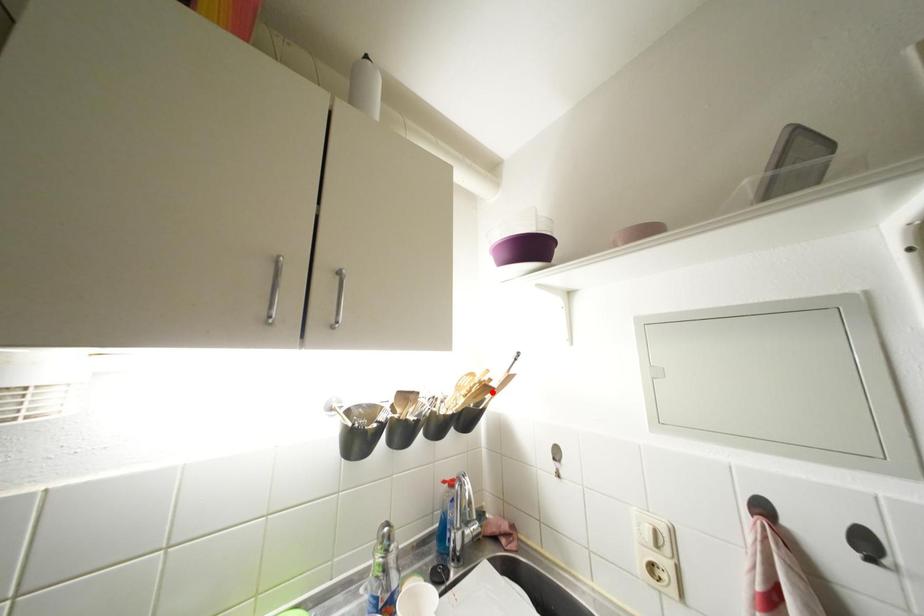
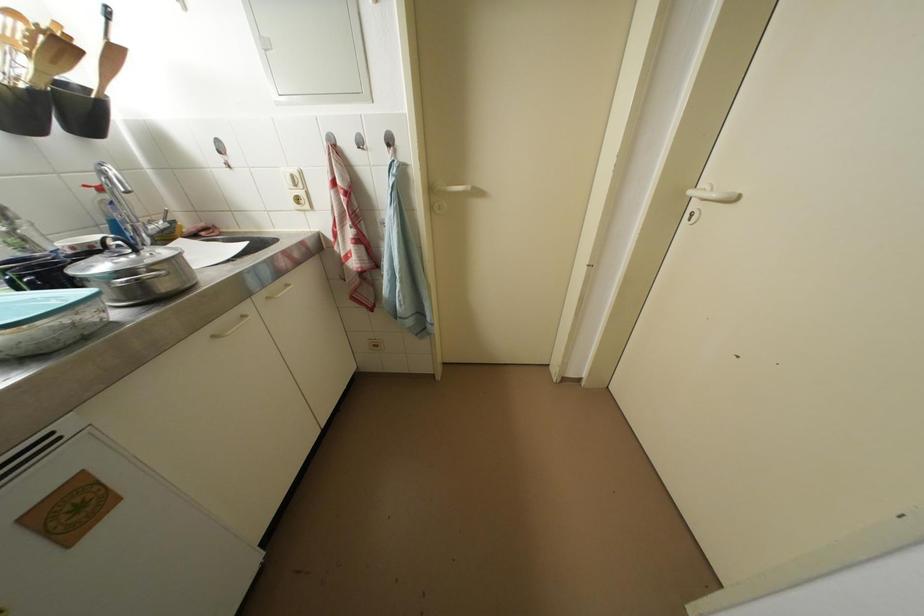
In the second image, find the point that corresponds to the highlighted location in the first image.

(69, 50)